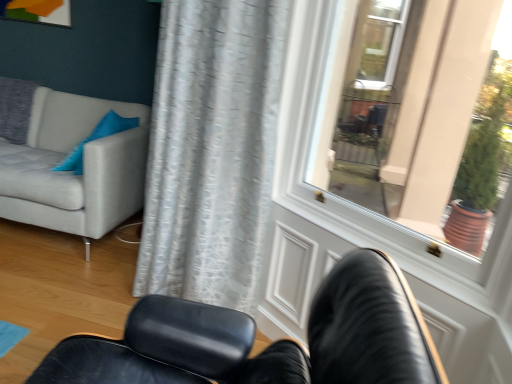
Question: Visually, is white glossy door at upper right positioned to the left or to the right of light gray fabric couch at left?

Choices:
 (A) left
 (B) right

Answer: (B)

Question: Is white glossy door at upper right wider or thinner than light gray fabric couch at left?

Choices:
 (A) wide
 (B) thin

Answer: (B)

Question: Estimate the real-world distances between objects in this image. Which object is closer to the blue fabric pillow at upper left?

Choices:
 (A) light gray fabric couch at left
 (B) white glossy door at upper right
 (C) white textured curtain at center
 (D) black leather chair at lower center

Answer: (A)

Question: Estimate the real-world distances between objects in this image. Which object is closer to the blue fabric pillow at upper left?

Choices:
 (A) white glossy door at upper right
 (B) light gray fabric couch at left
 (C) white textured curtain at center
 (D) black leather chair at lower center

Answer: (B)